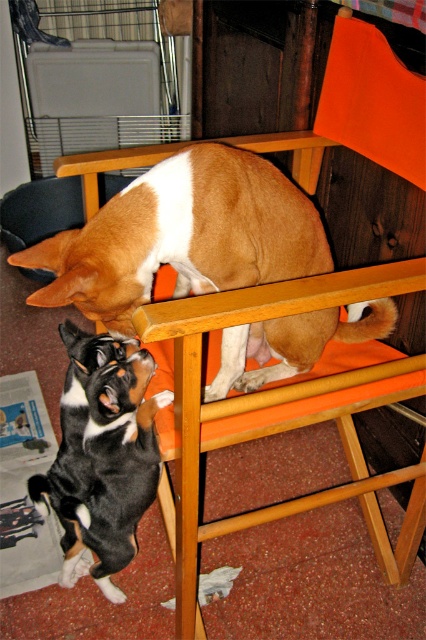
Question: Which point is closer to the camera?

Choices:
 (A) (199, 188)
 (B) (89, 355)
 (C) (192, 333)

Answer: (C)

Question: Can you confirm if orange fabric stool at upper center is wider than black and white fur at lower left?

Choices:
 (A) yes
 (B) no

Answer: (A)

Question: From the image, what is the correct spatial relationship of brown matte dog at upper center in relation to black and white fur at lower left?

Choices:
 (A) left
 (B) right

Answer: (B)

Question: Among these objects, which one is farthest from the camera?

Choices:
 (A) black and white fur at lower left
 (B) orange fabric stool at upper center

Answer: (A)

Question: Which object is closer to the camera taking this photo?

Choices:
 (A) brown matte dog at upper center
 (B) orange fabric stool at upper center

Answer: (B)

Question: Is brown matte dog at upper center above black and white fur at lower left?

Choices:
 (A) no
 (B) yes

Answer: (B)